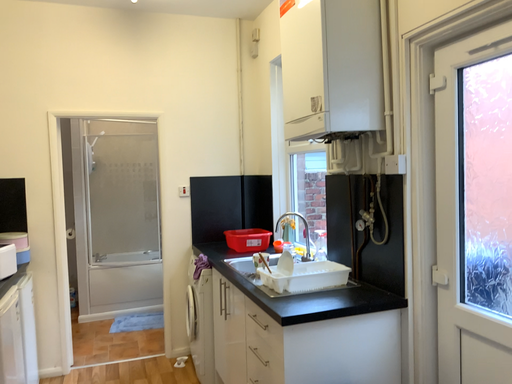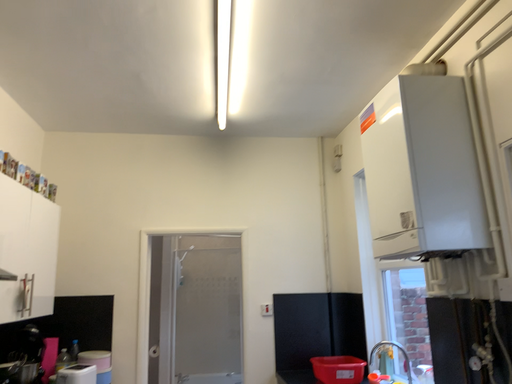
Question: Which way did the camera rotate in the video?

Choices:
 (A) rotated right
 (B) rotated left

Answer: (B)